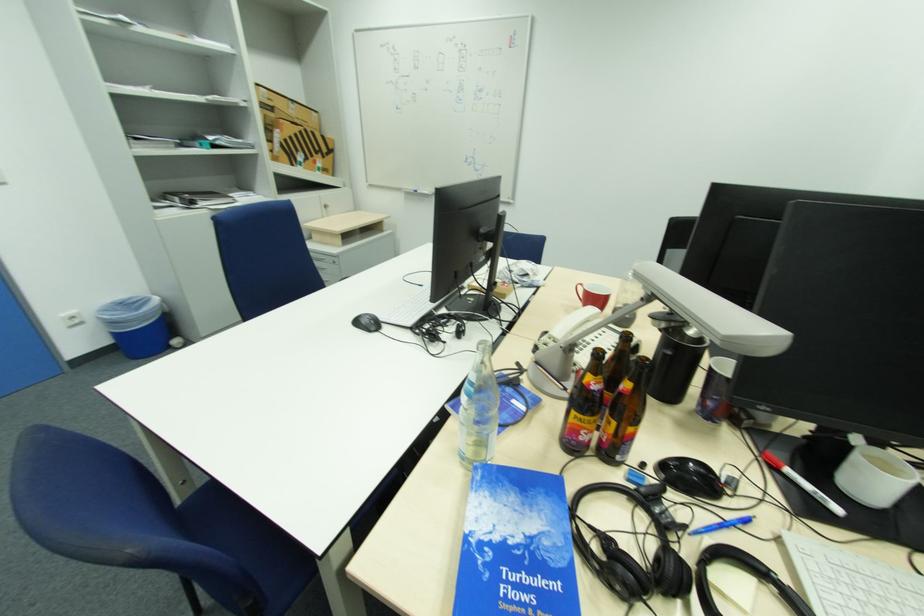
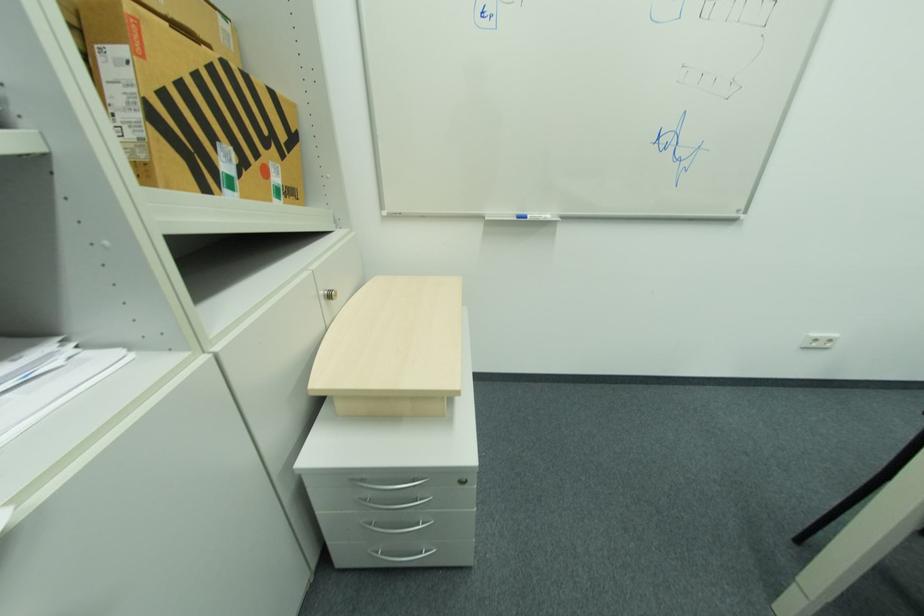
The images are taken continuously from a first-person perspective. In which direction are you moving?

The movement direction of the cameraman is left, forward.